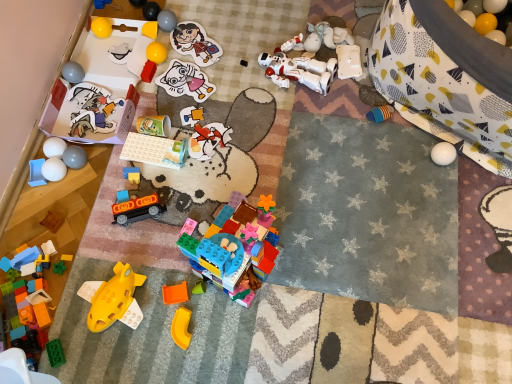
This screenshot has height=384, width=512. Identify the location of vacant space to the left of matte cardboard cutout at upper left, positioned as the eleventh toy in left-to-right order. (52, 117).